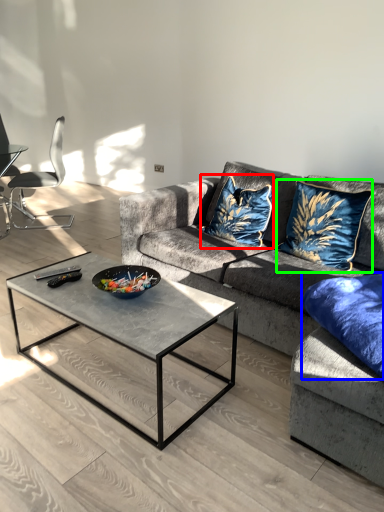
Question: Which object is the farthest from throw pillow (highlighted by a red box)? Choose among these: pillow (highlighted by a blue box) or throw pillow (highlighted by a green box).

Choices:
 (A) pillow
 (B) throw pillow

Answer: (A)